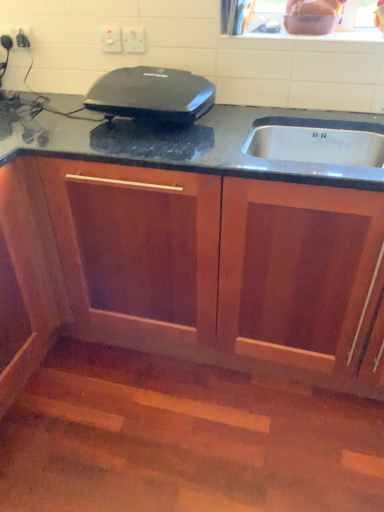
Measure the distance between point (x=9, y=49) and camera.

They are 5.92 feet apart.

Measure the distance between black glossy waffle maker at center and camera.

The depth of black glossy waffle maker at center is 1.42 meters.

The height and width of the screenshot is (512, 384). What do you see at coordinates (151, 94) in the screenshot? I see `black glossy waffle maker at center` at bounding box center [151, 94].

Find the location of a particular element. The width and height of the screenshot is (384, 512). white plastic electric outlet at upper center, acting as the 2th electric outlet starting from the left is located at coordinates (133, 40).

Locate an element on the screen. white plastic electric outlet at upper center, the first electric outlet from the left is located at coordinates (110, 39).

From a real-world perspective, is white plastic electric outlet at upper center, placed as the first electric outlet when sorted from right to left, physically located above or below wooden cabinet at center?

From a real-world perspective, white plastic electric outlet at upper center, placed as the first electric outlet when sorted from right to left, is physically above wooden cabinet at center.

Is white plastic electric outlet at upper center, placed as the first electric outlet when sorted from right to left, not inside wooden cabinet at center?

That's correct, white plastic electric outlet at upper center, placed as the first electric outlet when sorted from right to left, is outside of wooden cabinet at center.

Identify the location of the 1st electric outlet above when counting from the wooden cabinet at center (from the image's perspective). The width and height of the screenshot is (384, 512). (133, 40).

Is there a large distance between white plastic electric outlet at upper center, acting as the 2th electric outlet starting from the left, and wooden cabinet at center?

That's not correct — white plastic electric outlet at upper center, acting as the 2th electric outlet starting from the left, is a little close to wooden cabinet at center.

Is white plastic electric outlet at upper center, the first electric outlet from the left, next to wooden cabinet at center and touching it?

There is a gap between white plastic electric outlet at upper center, the first electric outlet from the left, and wooden cabinet at center.

Looking at this image, which point is more distant from viewer, (105, 29) or (7, 94)?

The point (7, 94) is more distant.

You are a GUI agent. You are given a task and a screenshot of the screen. Output one action in this format:
    pyautogui.click(x=<x>, y=<y>)
    Task: Click on the cabinetry on the right of white plastic electric outlet at upper center, which is the 2th electric outlet in right-to-left order
    This screenshot has height=512, width=384.
    Given the screenshot: What is the action you would take?
    pyautogui.click(x=189, y=242)

Which object is positioned more to the right, white plastic electric outlet at upper center, which is the 2th electric outlet in right-to-left order, or wooden cabinet at center?

wooden cabinet at center.

Which object is closer to the camera taking this photo, metallic silver toaster at upper left or black glossy waffle maker at center?

black glossy waffle maker at center is more forward.

Does point (9, 44) lie behind point (130, 70)?

Yes.

Based on their sizes in the image, would you say metallic silver toaster at upper left is bigger or smaller than black glossy waffle maker at center?

Clearly, metallic silver toaster at upper left is smaller in size than black glossy waffle maker at center.

Which of these two, metallic silver toaster at upper left or black glossy waffle maker at center, is thinner?

metallic silver toaster at upper left.

Is white plastic electric outlet at upper center, the first electric outlet from the left, completely or partially inside black glossy waffle maker at center?

No, white plastic electric outlet at upper center, the first electric outlet from the left, is not a part of black glossy waffle maker at center.

From the image's perspective, which is above, black glossy waffle maker at center or white plastic electric outlet at upper center, the first electric outlet from the left?

From the image's view, white plastic electric outlet at upper center, the first electric outlet from the left, is above.

Is the depth of black glossy waffle maker at center greater than that of white plastic electric outlet at upper center, the first electric outlet from the left?

No, it is in front of white plastic electric outlet at upper center, the first electric outlet from the left.

Is black glossy waffle maker at center positioned far away from white plastic electric outlet at upper center, which is the 2th electric outlet in right-to-left order?

No.

How many degrees apart are the facing directions of black glossy waffle maker at center and metallic silver toaster at upper left?

They differ by 3.24 degrees in their facing directions.

From the image's perspective, is black glossy waffle maker at center located above or below metallic silver toaster at upper left?

From the image's perspective, black glossy waffle maker at center appears below metallic silver toaster at upper left.

Consider the image. Is black glossy waffle maker at center far away from metallic silver toaster at upper left?

black glossy waffle maker at center is near metallic silver toaster at upper left, not far away.

From a real-world perspective, is black glossy waffle maker at center positioned above or below metallic silver toaster at upper left?

Clearly, from a real-world perspective, black glossy waffle maker at center is below metallic silver toaster at upper left.

Does point (220, 301) come behind point (128, 38)?

No, (220, 301) is closer to viewer.

Considering the relative sizes of wooden cabinet at center and white plastic electric outlet at upper center, acting as the 2th electric outlet starting from the left, in the image provided, is wooden cabinet at center taller than white plastic electric outlet at upper center, acting as the 2th electric outlet starting from the left,?

Yes.

Who is smaller, wooden cabinet at center or white plastic electric outlet at upper center, placed as the first electric outlet when sorted from right to left?

With smaller size is white plastic electric outlet at upper center, placed as the first electric outlet when sorted from right to left.

Which object is further away from the camera taking this photo, wooden cabinet at center or white plastic electric outlet at upper center, placed as the first electric outlet when sorted from right to left?

white plastic electric outlet at upper center, placed as the first electric outlet when sorted from right to left, is more distant.

Is metallic silver toaster at upper left at the right side of wooden cabinet at center?

No.

Which point is more forward, [6,38] or [12,372]?

Point [12,372]

Is metallic silver toaster at upper left turned away from wooden cabinet at center?

No, wooden cabinet at center is not at the back of metallic silver toaster at upper left.

At what (x,y) coordinates should I click in order to perform the action: click on cabinetry below the white plastic electric outlet at upper center, acting as the 2th electric outlet starting from the left (from a real-world perspective). Please return your answer as a coordinate pair (x, y). This screenshot has width=384, height=512. Looking at the image, I should click on (189, 242).

Locate an element on the screen. This screenshot has width=384, height=512. electric outlet that is the 2nd object to the left of the wooden cabinet at center, starting at the anchor is located at coordinates (110, 39).

Estimate the real-world distances between objects in this image. Which object is closer to wooden cabinet at center, metallic silver toaster at upper left or black glossy waffle maker at center?

black glossy waffle maker at center lies closer to wooden cabinet at center than the other object.

Based on their spatial positions, is metallic silver toaster at upper left or black glossy waffle maker at center closer to white plastic electric outlet at upper center, acting as the 2th electric outlet starting from the left?

black glossy waffle maker at center is positioned closer to the anchor white plastic electric outlet at upper center, acting as the 2th electric outlet starting from the left.

From the picture: Based on their spatial positions, is white plastic electric outlet at upper center, the first electric outlet from the left, or black glossy waffle maker at center further from wooden cabinet at center?

white plastic electric outlet at upper center, the first electric outlet from the left.

Considering their positions, is white plastic electric outlet at upper center, which is the 2th electric outlet in right-to-left order, positioned further to white plastic electric outlet at upper center, placed as the first electric outlet when sorted from right to left, than wooden cabinet at center?

The object further to white plastic electric outlet at upper center, placed as the first electric outlet when sorted from right to left, is wooden cabinet at center.

When comparing their distances from white plastic electric outlet at upper center, acting as the 2th electric outlet starting from the left, does metallic silver toaster at upper left or white plastic electric outlet at upper center, the first electric outlet from the left, seem closer?

white plastic electric outlet at upper center, the first electric outlet from the left, lies closer to white plastic electric outlet at upper center, acting as the 2th electric outlet starting from the left, than the other object.

Considering their positions, is metallic silver toaster at upper left positioned further to black glossy waffle maker at center than white plastic electric outlet at upper center, placed as the first electric outlet when sorted from right to left?

→ metallic silver toaster at upper left is positioned further to the anchor black glossy waffle maker at center.

Considering their positions, is white plastic electric outlet at upper center, acting as the 2th electric outlet starting from the left, positioned further to wooden cabinet at center than black glossy waffle maker at center?

white plastic electric outlet at upper center, acting as the 2th electric outlet starting from the left, is positioned further to the anchor wooden cabinet at center.

From the image, which object appears to be nearer to wooden cabinet at center, metallic silver toaster at upper left or white plastic electric outlet at upper center, placed as the first electric outlet when sorted from right to left?

white plastic electric outlet at upper center, placed as the first electric outlet when sorted from right to left, is closer to wooden cabinet at center.

The width and height of the screenshot is (384, 512). I want to click on electric outlet between black glossy waffle maker at center and white plastic electric outlet at upper center, the first electric outlet from the left, along the z-axis, so click(133, 40).

Identify the location of home appliance between white plastic electric outlet at upper center, acting as the 2th electric outlet starting from the left, and wooden cabinet at center in the up-down direction. This screenshot has width=384, height=512. (151, 94).

Image resolution: width=384 pixels, height=512 pixels. In order to click on home appliance that lies between white plastic electric outlet at upper center, which is the 2th electric outlet in right-to-left order, and wooden cabinet at center from top to bottom in this screenshot , I will do `click(151, 94)`.

You are a GUI agent. You are given a task and a screenshot of the screen. Output one action in this format:
    pyautogui.click(x=<x>, y=<y>)
    Task: Click on the electric outlet between metallic silver toaster at upper left and white plastic electric outlet at upper center, placed as the first electric outlet when sorted from right to left
    This screenshot has width=384, height=512.
    Given the screenshot: What is the action you would take?
    pyautogui.click(x=110, y=39)